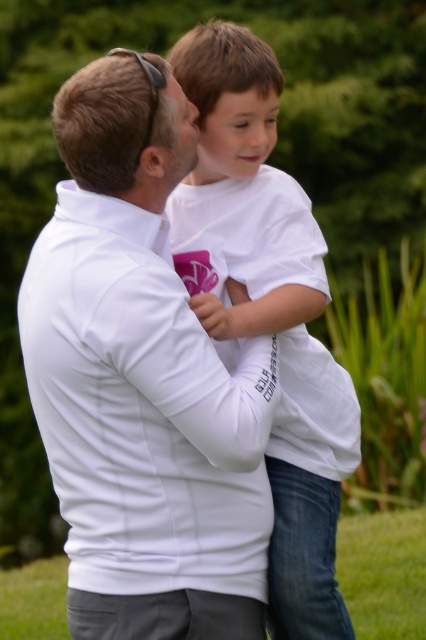
Question: Which point is farther to the camera?

Choices:
 (A) (204, 128)
 (B) (278, 522)
 (C) (178, 390)

Answer: (B)

Question: Which object is closer to the camera taking this photo?

Choices:
 (A) white matte jacket at center
 (B) smooth skin face at center

Answer: (A)

Question: Can you confirm if white matte jacket at center is positioned to the left of white matte shirt at center?

Choices:
 (A) yes
 (B) no

Answer: (A)

Question: Among these points, which one is nearest to the camera?

Choices:
 (A) (193, 477)
 (B) (238, 104)
 (C) (195, 141)

Answer: (A)

Question: Can you confirm if white matte jacket at center is wider than smooth white face at center?

Choices:
 (A) yes
 (B) no

Answer: (A)

Question: Does smooth white face at center appear on the right side of smooth skin face at center?

Choices:
 (A) no
 (B) yes

Answer: (B)